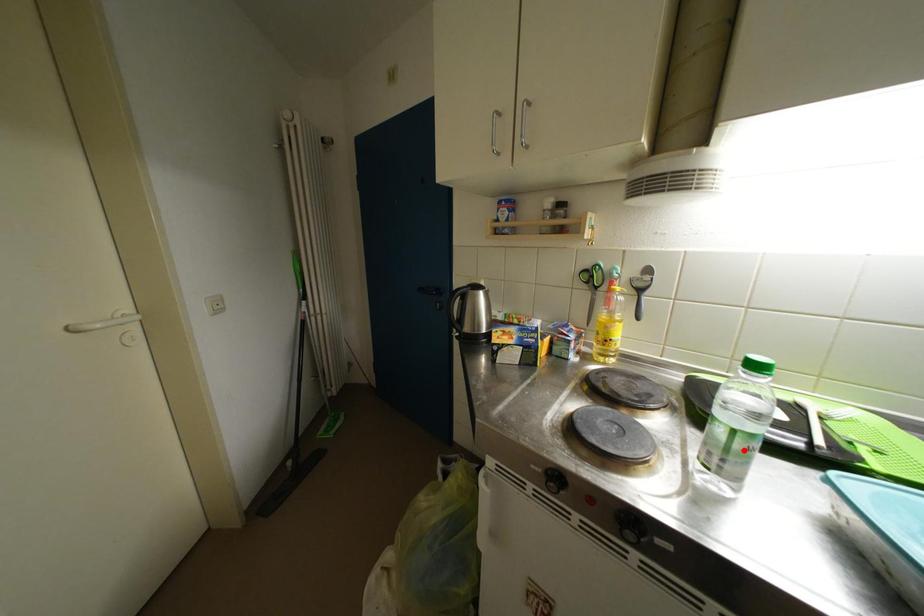
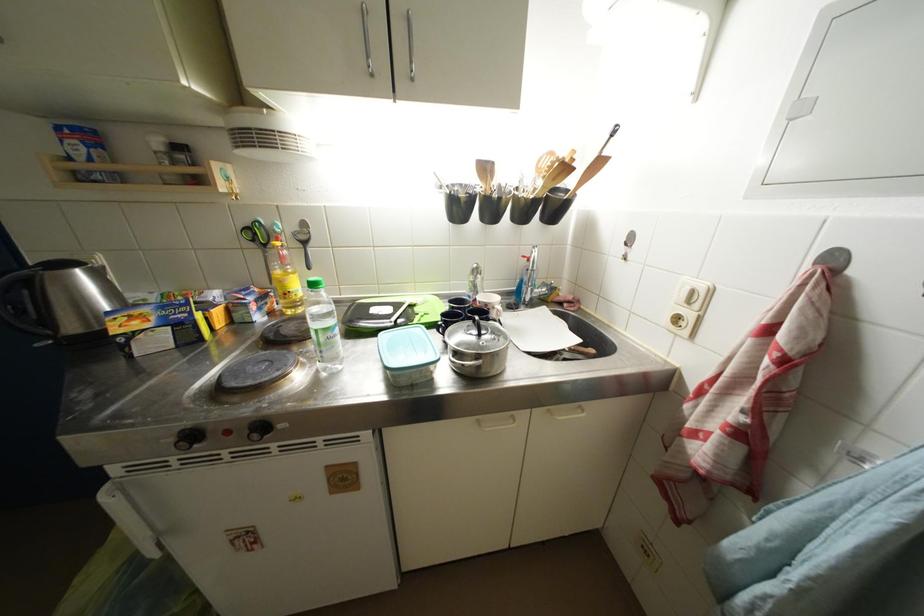
Locate, in the second image, the point that corresponds to the highlighted location in the first image.

(329, 344)